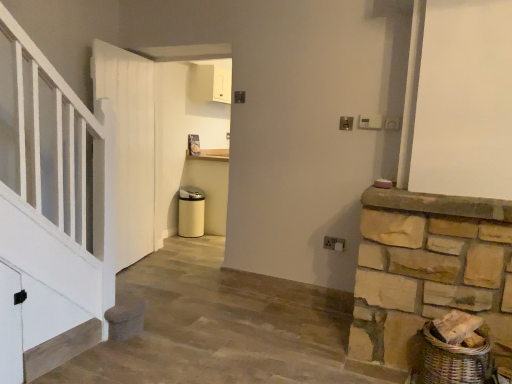
Find the location of `natural stone mantle at right`. natural stone mantle at right is located at coordinates (438, 204).

In order to face natural stone mantle at right, should I rotate leftwards or rightwards?

To face it directly, rotate right by 23.558 degrees.

The width and height of the screenshot is (512, 384). What do you see at coordinates (438, 204) in the screenshot?
I see `natural stone mantle at right` at bounding box center [438, 204].

Find the location of a particular element. The height and width of the screenshot is (384, 512). white wooden door at left is located at coordinates (129, 145).

Image resolution: width=512 pixels, height=384 pixels. What do you see at coordinates (129, 145) in the screenshot?
I see `white wooden door at left` at bounding box center [129, 145].

Identify the location of natural stone mantle at right. 438,204.

Considering the relative positions of natural stone mantle at right and white wooden door at left in the image provided, is natural stone mantle at right to the right of white wooden door at left from the viewer's perspective?

Yes.

Which object is further away from the camera, natural stone mantle at right or white wooden door at left?

Positioned behind is white wooden door at left.

Is point (403, 207) positioned behind point (121, 268)?

That is False.

From the image's perspective, is natural stone mantle at right located above white wooden door at left?

Actually, natural stone mantle at right appears below white wooden door at left in the image.

From a real-world perspective, does natural stone mantle at right sit lower than white wooden door at left?

Indeed, from a real-world perspective, natural stone mantle at right is positioned beneath white wooden door at left.

Which object is wider, natural stone mantle at right or white wooden door at left?

Wider between the two is natural stone mantle at right.

Is natural stone mantle at right shorter than white wooden door at left?

Yes.

Can you confirm if natural stone mantle at right is bigger than white wooden door at left?

No.

Do you think natural stone mantle at right is within white wooden door at left, or outside of it?

natural stone mantle at right is not inside white wooden door at left, it's outside.

Would you say natural stone mantle at right is a long distance from white wooden door at left?

That's right, there is a large distance between natural stone mantle at right and white wooden door at left.

Is natural stone mantle at right positioned with its back to white wooden door at left?

No, white wooden door at left is not at the back of natural stone mantle at right.

How different are the orientations of natural stone mantle at right and white wooden door at left in degrees?

102 degrees.

Where is `mantle located underneath the white wooden door at left (from a real-world perspective)`? The width and height of the screenshot is (512, 384). mantle located underneath the white wooden door at left (from a real-world perspective) is located at coordinates (438, 204).

Is white wooden door at left to the right of natural stone mantle at right from the viewer's perspective?

No.

Is white wooden door at left closer to the viewer compared to natural stone mantle at right?

No, it is behind natural stone mantle at right.

Between point (112, 76) and point (428, 212), which one is positioned in front?

Positioned in front is point (428, 212).

From the image's perspective, does white wooden door at left appear higher than natural stone mantle at right?

Yes, from the image's perspective, white wooden door at left is on top of natural stone mantle at right.

In the scene shown: From a real-world perspective, is white wooden door at left positioned above or below natural stone mantle at right?

white wooden door at left is situated higher than natural stone mantle at right in the real world.

Is white wooden door at left wider or thinner than natural stone mantle at right?

Clearly, white wooden door at left has less width compared to natural stone mantle at right.

Which of these two, white wooden door at left or natural stone mantle at right, stands shorter?

natural stone mantle at right is shorter.

Is white wooden door at left bigger or smaller than natural stone mantle at right?

In the image, white wooden door at left appears to be larger than natural stone mantle at right.

Is white wooden door at left located outside natural stone mantle at right?

Yes, white wooden door at left is located beyond the bounds of natural stone mantle at right.

Would you say white wooden door at left is a long distance from natural stone mantle at right?

white wooden door at left is far away from natural stone mantle at right.

Is natural stone mantle at right at the back of white wooden door at left?

No, white wooden door at left's orientation is not away from natural stone mantle at right.

How different are the orientations of white wooden door at left and natural stone mantle at right in degrees?

There is a 102-degree angle between the facing directions of white wooden door at left and natural stone mantle at right.

This screenshot has width=512, height=384. What are the coordinates of `mantle lying on the right of white wooden door at left` in the screenshot? It's located at (438, 204).

Locate an element on the screen. This screenshot has height=384, width=512. door on the left of natural stone mantle at right is located at coordinates (129, 145).

I want to click on mantle below the white wooden door at left (from the image's perspective), so click(x=438, y=204).